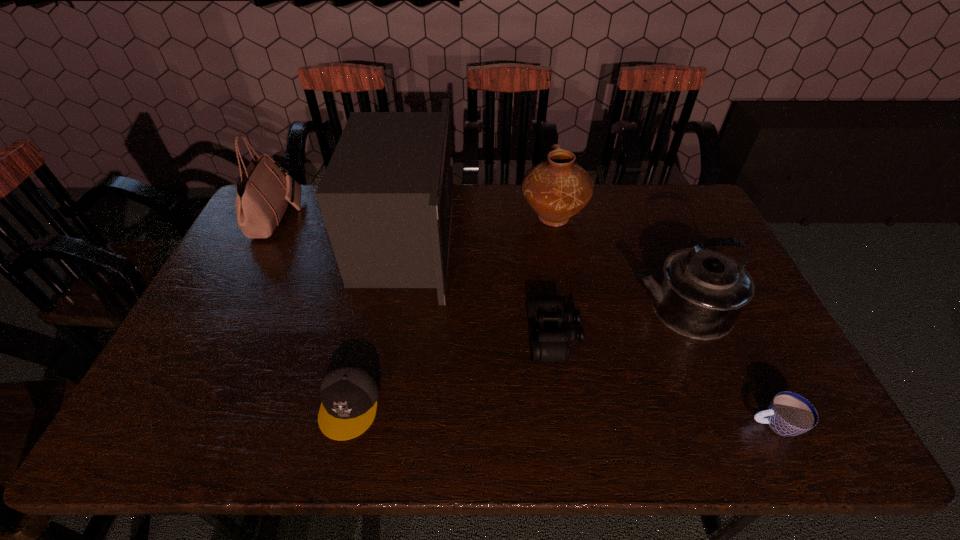
Where is `vacant area situated 0.350m with the spout at the front of the kettle`? This screenshot has height=540, width=960. vacant area situated 0.350m with the spout at the front of the kettle is located at coordinates 503,308.

Identify the location of vacant space located 0.100m with the spout at the front of the kettle. (591, 308).

Where is `vacant position located at the eyepieces of the binoculars`? vacant position located at the eyepieces of the binoculars is located at coordinates (450, 334).

The width and height of the screenshot is (960, 540). I want to click on vacant space situated 0.250m at the eyepieces of the binoculars, so click(x=436, y=334).

At what (x,y) coordinates should I click in order to perform the action: click on free space located 0.180m at the eyepieces of the binoculars. Please return your answer as a coordinate pair (x, y). The image size is (960, 540). Looking at the image, I should click on (462, 334).

The image size is (960, 540). I want to click on vacant space located on the side of the shortest object with the handle, so click(648, 424).

Locate an element on the screen. This screenshot has width=960, height=540. vacant space located on the side of the shortest object with the handle is located at coordinates (644, 424).

Identify the location of vacant point located on the side of the shortest object with the handle. (574, 424).

Locate an element on the screen. The image size is (960, 540). microwave oven that is at the far edge is located at coordinates (x=386, y=197).

The width and height of the screenshot is (960, 540). Find the location of `handbag that is at the far edge`. handbag that is at the far edge is located at coordinates (264, 191).